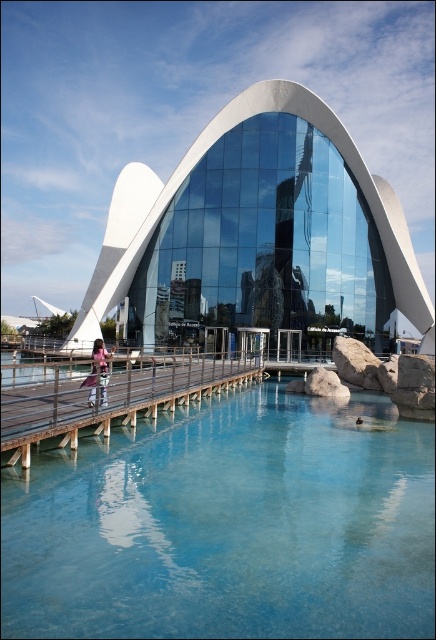
Who is positioned more to the right, wooden dock at lower center or pink fabric at left?

wooden dock at lower center

Where is `wooden dock at lower center`? This screenshot has width=436, height=640. wooden dock at lower center is located at coordinates (112, 397).

Is transparent glass water at center above white glass building at center?

No.

The height and width of the screenshot is (640, 436). In order to click on transparent glass water at center in this screenshot , I will do `click(228, 525)`.

Is point (81, 589) farther from viewer compared to point (363, 209)?

No, (81, 589) is closer to viewer.

At what (x,y) coordinates should I click in order to perform the action: click on transparent glass water at center. Please return your answer as a coordinate pair (x, y). Looking at the image, I should click on pyautogui.click(x=228, y=525).

Is transparent glass water at center bigger than wooden dock at lower center?

Incorrect, transparent glass water at center is not larger than wooden dock at lower center.

Does transparent glass water at center appear under wooden dock at lower center?

Correct, transparent glass water at center is located below wooden dock at lower center.

Identify the location of transparent glass water at center. (228, 525).